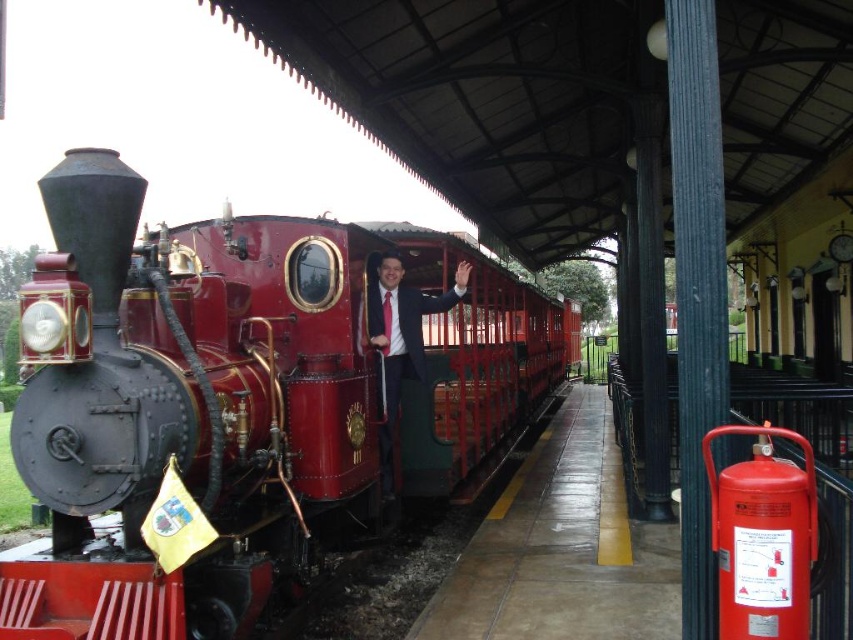
Question: Does shiny red locomotive at center have a smaller size compared to matte black suit at center?

Choices:
 (A) yes
 (B) no

Answer: (B)

Question: Which point is closer to the camera?

Choices:
 (A) matte black suit at center
 (B) shiny red locomotive at center

Answer: (B)

Question: Is shiny red locomotive at center positioned at the back of matte black suit at center?

Choices:
 (A) yes
 (B) no

Answer: (B)

Question: Which object is farther from the camera taking this photo?

Choices:
 (A) matte black suit at center
 (B) shiny red locomotive at center

Answer: (A)

Question: Is shiny red locomotive at center smaller than matte black suit at center?

Choices:
 (A) yes
 (B) no

Answer: (B)